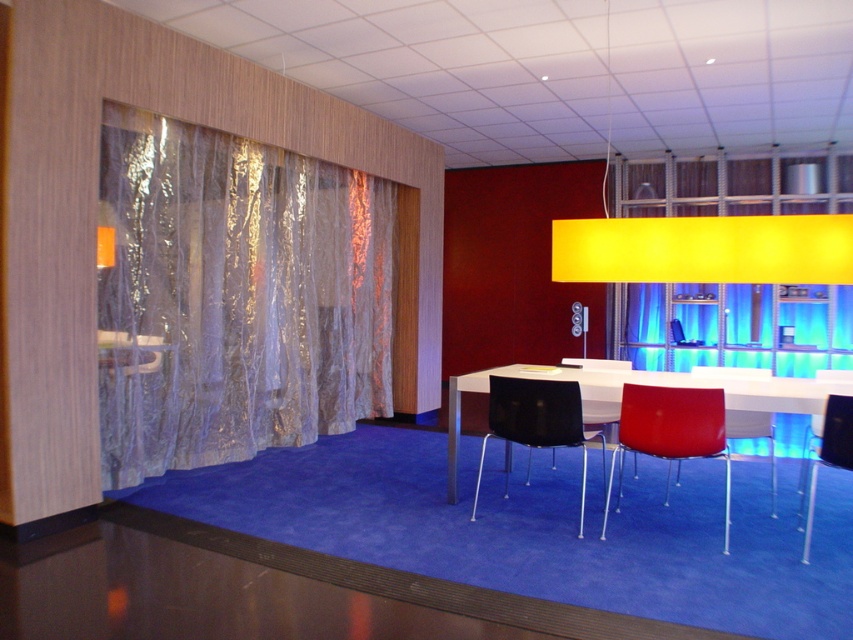
Question: Can you confirm if matte black chair at lower right is bigger than black plastic chair at center?

Choices:
 (A) yes
 (B) no

Answer: (A)

Question: Can you confirm if translucent metallic curtain at left is positioned below black plastic chair at center?

Choices:
 (A) yes
 (B) no

Answer: (B)

Question: Does white glossy table at center lie behind matte red chair at center?

Choices:
 (A) no
 (B) yes

Answer: (A)

Question: Which of the following is the closest to the observer?

Choices:
 (A) black metal chair at center
 (B) matte red chair at center
 (C) matte black chair at lower right

Answer: (C)

Question: Which point appears closest to the camera in this image?

Choices:
 (A) (457, 387)
 (B) (572, 429)
 (C) (805, 531)
 (D) (757, 422)

Answer: (C)

Question: Which point is closer to the camera taking this photo?

Choices:
 (A) (601, 413)
 (B) (448, 465)
 (C) (729, 481)
 (D) (735, 371)

Answer: (B)